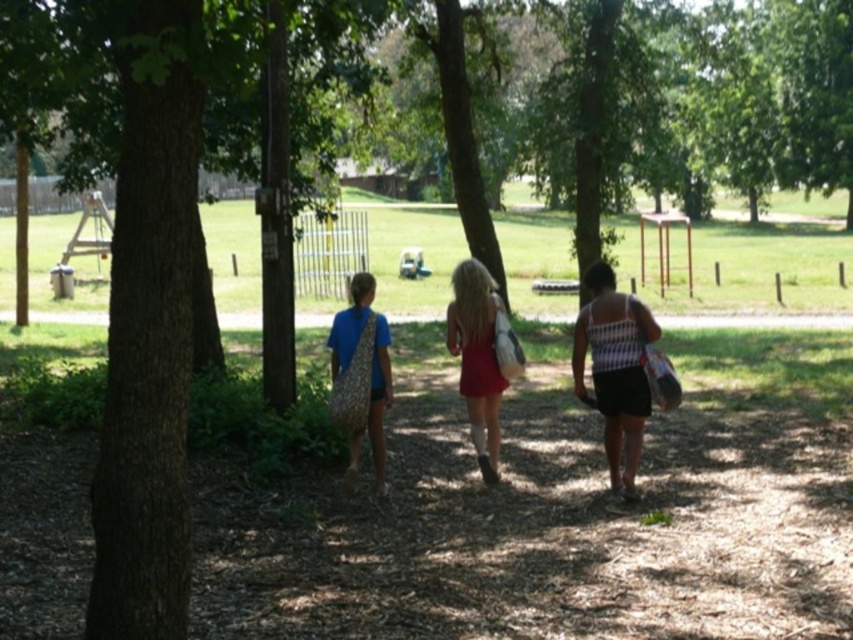
You are standing at the point labeled point [659,332] and want to walk to the point labeled point [473,291]. Which direction should you move to get closer to your destination?

You should move away from the viewer to reach point [473,291] because it is further away than point [659,332].

You are a photographer trying to capture a candid shot of the two people at the center of the park path. The camera you have can focus on subjects within a 3 feet range. Given that the white textured tank top at center and matte red dress at center are 3.62 feet apart, will both subjects be in focus if you aim the camera at the midpoint between them?

The white textured tank top at center and matte red dress at center are 3.62 feet apart. If the camera can focus within a 3 feet range, aiming at the midpoint would mean each subject is 1.81 feet from the focus point. Since 1.81 feet is within the 3 feet range, both subjects will be in focus.